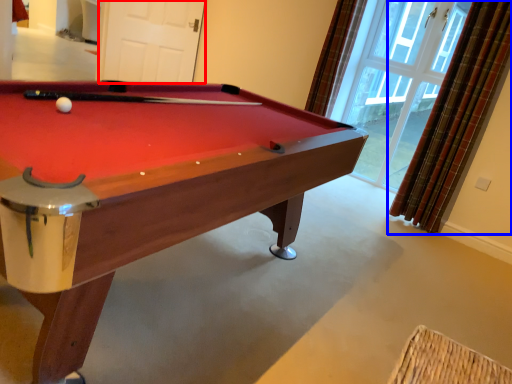
Question: Which object appears closest to the camera in this image, screen door (highlighted by a red box) or curtain (highlighted by a blue box)?

Choices:
 (A) screen door
 (B) curtain

Answer: (B)